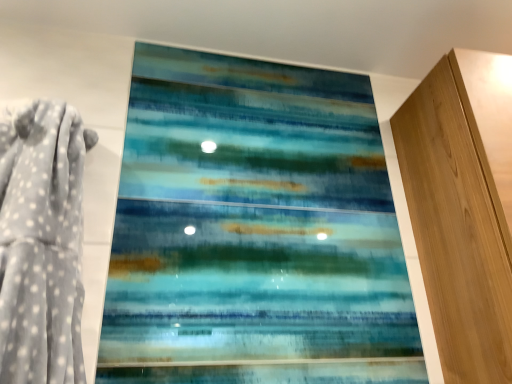
Locate an element on the screen. light brown wood door at right is located at coordinates (463, 208).

Describe the element at coordinates (463, 208) in the screenshot. I see `light brown wood door at right` at that location.

This screenshot has height=384, width=512. Identify the location of light brown wood door at right. (463, 208).